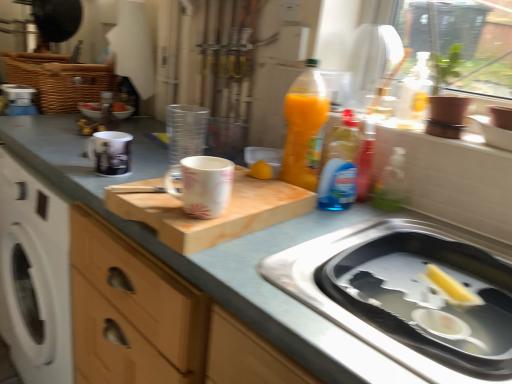
Find the location of a particular element. Image resolution: width=512 pixels, height=384 pixels. vacant region in front of wooden cutting board at center is located at coordinates (273, 274).